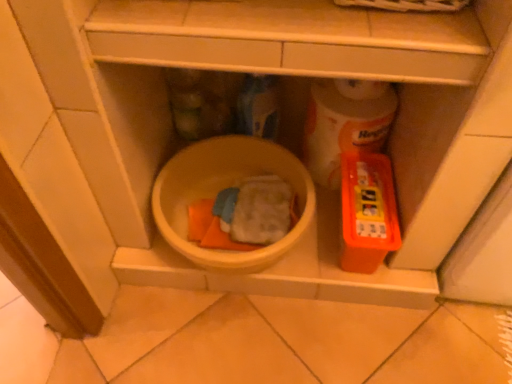
Question: Is orange plastic container at right aimed at yellow matte mixing bowl at center?

Choices:
 (A) yes
 (B) no

Answer: (B)

Question: Considering the relative sizes of orange plastic container at right and yellow matte mixing bowl at center in the image provided, is orange plastic container at right thinner than yellow matte mixing bowl at center?

Choices:
 (A) yes
 (B) no

Answer: (A)

Question: Is orange plastic container at right closer to camera compared to yellow matte mixing bowl at center?

Choices:
 (A) no
 (B) yes

Answer: (A)

Question: Is orange plastic container at right positioned beyond the bounds of yellow matte mixing bowl at center?

Choices:
 (A) no
 (B) yes

Answer: (B)

Question: Is orange plastic container at right in contact with yellow matte mixing bowl at center?

Choices:
 (A) no
 (B) yes

Answer: (A)

Question: From the image's perspective, is orange plastic container at right above yellow matte mixing bowl at center?

Choices:
 (A) yes
 (B) no

Answer: (B)

Question: Is orange plastic container at right completely or partially inside yellow matte mixing bowl at center?

Choices:
 (A) no
 (B) yes

Answer: (A)

Question: Does yellow matte mixing bowl at center have a lesser width compared to orange plastic container at right?

Choices:
 (A) yes
 (B) no

Answer: (B)

Question: Does yellow matte mixing bowl at center have a larger size compared to orange plastic container at right?

Choices:
 (A) no
 (B) yes

Answer: (B)

Question: From a real-world perspective, is yellow matte mixing bowl at center physically above orange plastic container at right?

Choices:
 (A) no
 (B) yes

Answer: (A)

Question: From a real-world perspective, is yellow matte mixing bowl at center located beneath orange plastic container at right?

Choices:
 (A) no
 (B) yes

Answer: (B)

Question: Considering the relative sizes of yellow matte mixing bowl at center and orange plastic container at right in the image provided, is yellow matte mixing bowl at center shorter than orange plastic container at right?

Choices:
 (A) yes
 (B) no

Answer: (A)

Question: Can you confirm if orange plastic container at right is taller than white glossy toilet paper at center right?

Choices:
 (A) yes
 (B) no

Answer: (B)